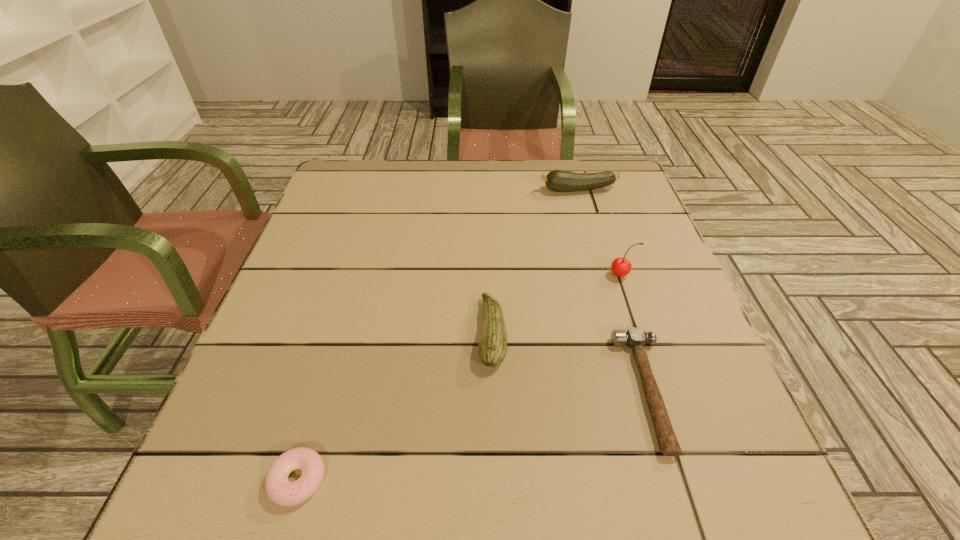
Locate an element on the screen. The width and height of the screenshot is (960, 540). hammer present at the near edge is located at coordinates (635, 338).

Locate an element on the screen. doughnut that is at the near edge is located at coordinates (282, 492).

Where is `object at the left edge`? Image resolution: width=960 pixels, height=540 pixels. object at the left edge is located at coordinates (282, 492).

Image resolution: width=960 pixels, height=540 pixels. What are the coordinates of `cherry that is at the right edge` in the screenshot? It's located at (621, 267).

Locate an element on the screen. This screenshot has width=960, height=540. zucchini that is at the right edge is located at coordinates (557, 180).

Where is `hammer at the right edge`? This screenshot has width=960, height=540. hammer at the right edge is located at coordinates (635, 338).

The width and height of the screenshot is (960, 540). Find the location of `object that is positioned at the near left corner`. object that is positioned at the near left corner is located at coordinates (282, 492).

The image size is (960, 540). I want to click on object that is at the far right corner, so click(x=557, y=180).

Identify the location of object present at the near right corner. The image size is (960, 540). (635, 338).

Where is `blank space at the far edge`? The image size is (960, 540). blank space at the far edge is located at coordinates (490, 204).